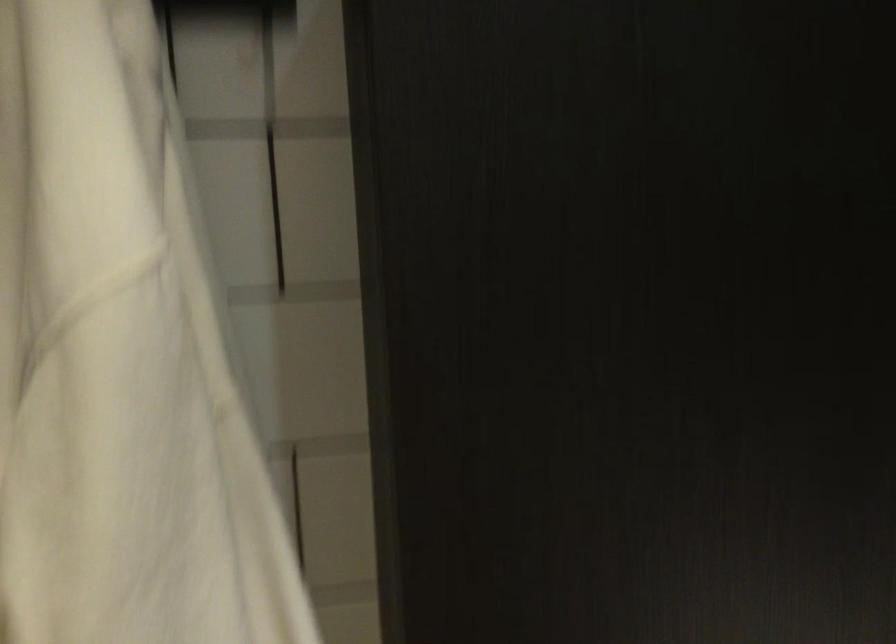
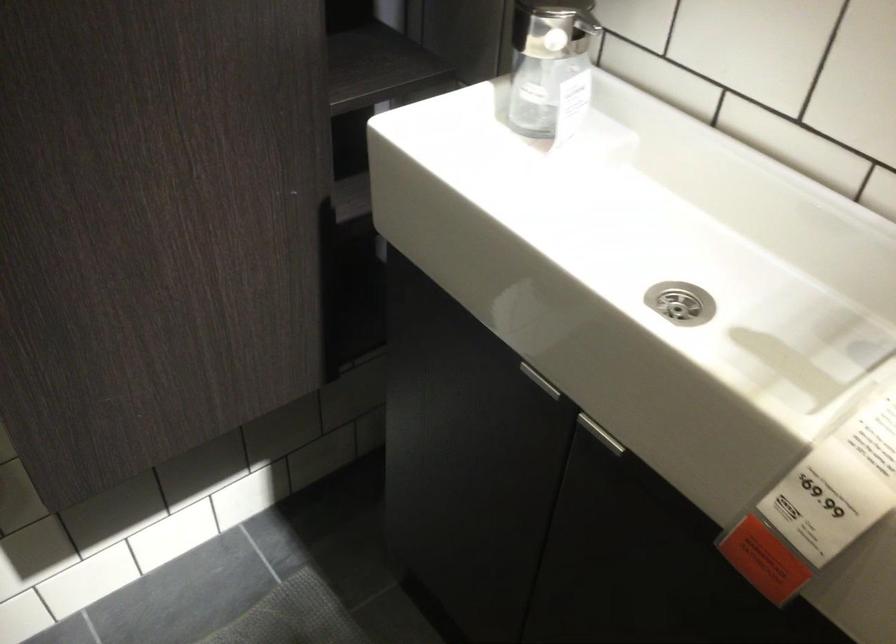
The first image is from the beginning of the video and the second image is from the end. How did the camera likely rotate when shooting the video?

The camera's rotation is toward right-down.